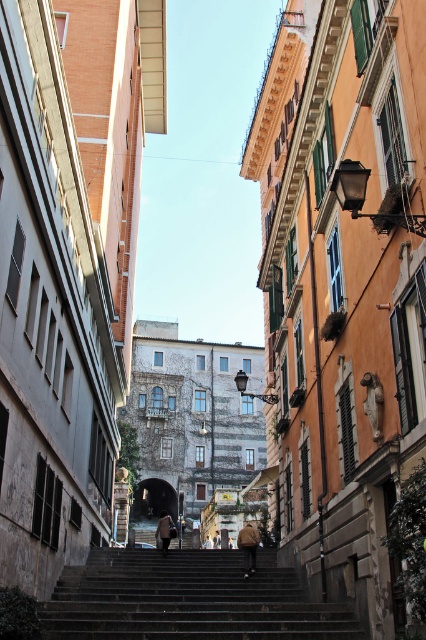
You are standing at the bottom of the stone steps in the urban street scene. You see a brown leather coat at center and a light brown leather jacket at center. Which one is nearer to you?

The brown leather coat at center is closer to the viewer than the light brown leather jacket at center, so the brown leather coat at center is nearer to you.

You are a delivery person carrying a package and need to climb the dark gray concrete stairs at center. You notice a brown leather coat at center nearby. Which object is shorter in height between the two?

The dark gray concrete stairs at center has a lesser height compared to the brown leather coat at center, so the stairs are shorter in height.